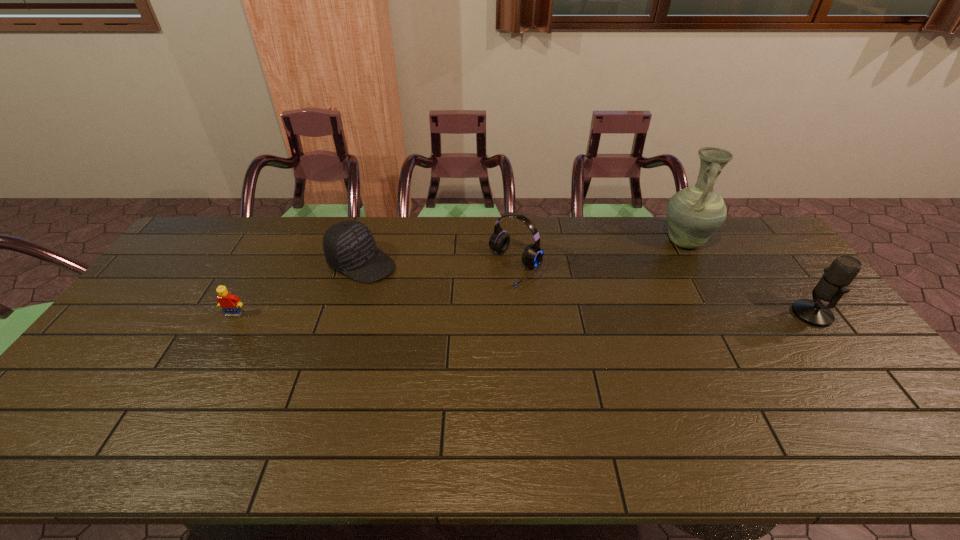
You are a GUI agent. You are given a task and a screenshot of the screen. Output one action in this format:
    pyautogui.click(x=<x>, y=<y>)
    Task: Click on the free space that satisfies the following two spatial constraints: 1. on the front side of the fourth tallest object; 2. on the right side of the headset
    The width and height of the screenshot is (960, 540).
    Given the screenshot: What is the action you would take?
    pyautogui.click(x=360, y=267)

Where is `vacant space that satisfies the following two spatial constraints: 1. on the front side of the headset; 2. on the right side of the second object from left to right`? The image size is (960, 540). vacant space that satisfies the following two spatial constraints: 1. on the front side of the headset; 2. on the right side of the second object from left to right is located at coordinates (360, 267).

At what (x,y) coordinates should I click in order to perform the action: click on free space that satisfies the following two spatial constraints: 1. on the front side of the fourth object from right to left; 2. on the side of the rightmost object with the red ring. Please return your answer as a coordinate pair (x, y). The width and height of the screenshot is (960, 540). Looking at the image, I should click on pos(346,314).

This screenshot has height=540, width=960. Identify the location of free spot that satisfies the following two spatial constraints: 1. on the back side of the tallest object; 2. on the left side of the headset. (514, 241).